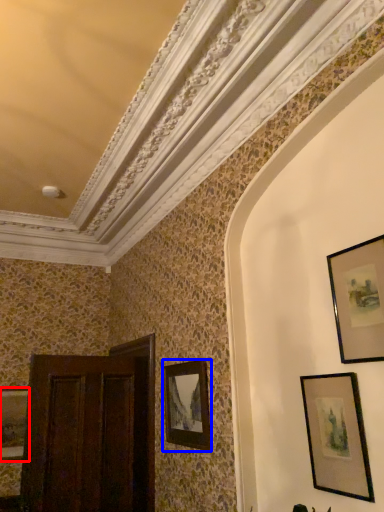
Question: Among these objects, which one is farthest to the camera, picture frame (highlighted by a red box) or picture frame (highlighted by a blue box)?

Choices:
 (A) picture frame
 (B) picture frame

Answer: (A)